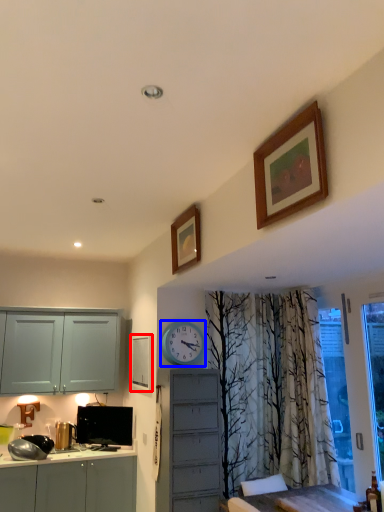
Question: Among these objects, which one is nearest to the camera, picture frame (highlighted by a red box) or clock (highlighted by a blue box)?

Choices:
 (A) picture frame
 (B) clock

Answer: (B)